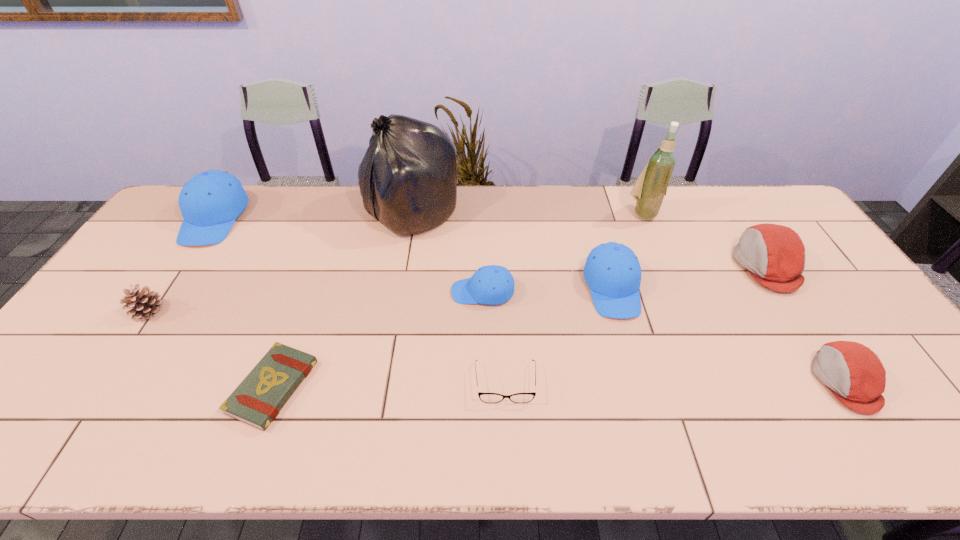
Image resolution: width=960 pixels, height=540 pixels. What are the coordinates of `free space located 0.190m on the front-facing side of the farther red cap` in the screenshot? It's located at (673, 266).

Locate an element on the screen. This screenshot has width=960, height=540. vacant space located on the front-facing side of the farther red cap is located at coordinates (706, 266).

Locate an element on the screen. This screenshot has width=960, height=540. free location located on the left of the brown pinecone is located at coordinates (114, 311).

This screenshot has width=960, height=540. I want to click on free space located 0.070m on the front-facing side of the smallest blue cap, so click(427, 292).

Locate an element on the screen. This screenshot has width=960, height=540. free space located 0.110m on the front-facing side of the smallest blue cap is located at coordinates (413, 292).

I want to click on vacant position located 0.350m on the front-facing side of the smallest blue cap, so click(328, 292).

I want to click on vacant space situated on the front-facing side of the nearest cap, so click(x=704, y=381).

This screenshot has height=540, width=960. In order to click on free space located on the front-facing side of the nearest cap in this screenshot , I will do `click(791, 381)`.

Find the location of `vacant area situated 0.160m on the front-facing side of the nearest cap`. vacant area situated 0.160m on the front-facing side of the nearest cap is located at coordinates (749, 381).

Find the location of a particular element. The image size is (960, 540). vacant space positioned 0.080m on the front-facing side of the spectacles is located at coordinates (508, 437).